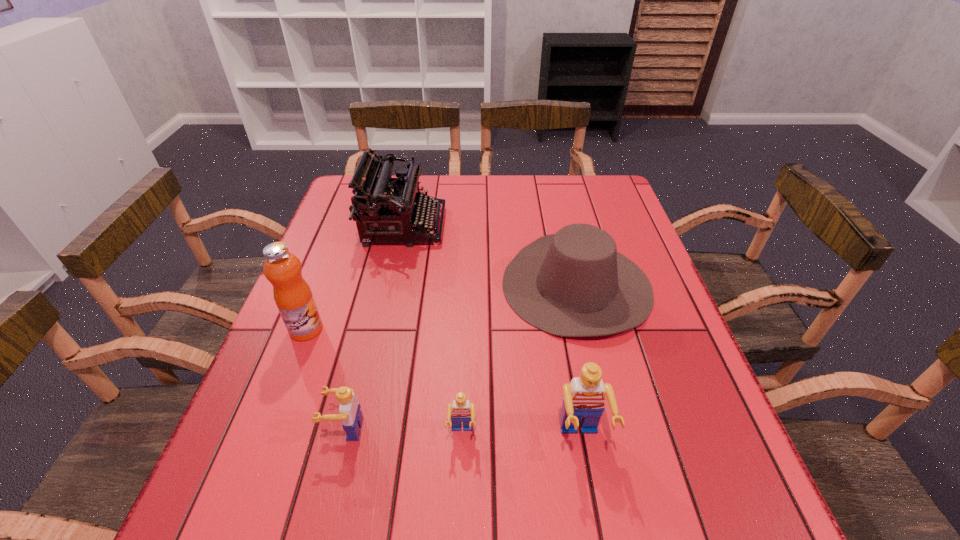
This screenshot has height=540, width=960. I want to click on free space located on the face of the leftmost Lego, so click(284, 429).

You are a GUI agent. You are given a task and a screenshot of the screen. Output one action in this format:
    pyautogui.click(x=<x>, y=<y>)
    Task: Click on the blank area located on the keyboard of the typewriter
    This screenshot has width=960, height=540.
    Given the screenshot: What is the action you would take?
    pyautogui.click(x=461, y=226)

Locate an element on the screen. This screenshot has height=540, width=960. blank space located 0.070m on the back of the cowboy hat is located at coordinates (563, 226).

Locate an element on the screen. The image size is (960, 540). vacant region located on the back of the leftmost object is located at coordinates (329, 269).

You are a GUI agent. You are given a task and a screenshot of the screen. Output one action in this format:
    pyautogui.click(x=<x>, y=<y>)
    Task: Click on the object present at the far edge
    The width and height of the screenshot is (960, 540).
    Given the screenshot: What is the action you would take?
    pyautogui.click(x=385, y=209)

Where is `typewriter at the left edge`? The image size is (960, 540). typewriter at the left edge is located at coordinates (385, 209).

I want to click on fruit juice that is at the left edge, so click(x=294, y=299).

The width and height of the screenshot is (960, 540). I want to click on object situated at the right edge, so click(574, 283).

Where is `object that is positioned at the far left corner`? The image size is (960, 540). object that is positioned at the far left corner is located at coordinates (385, 209).

In the image, there is a desktop. Identify the location of vacant space at the far edge. This screenshot has width=960, height=540. (444, 198).